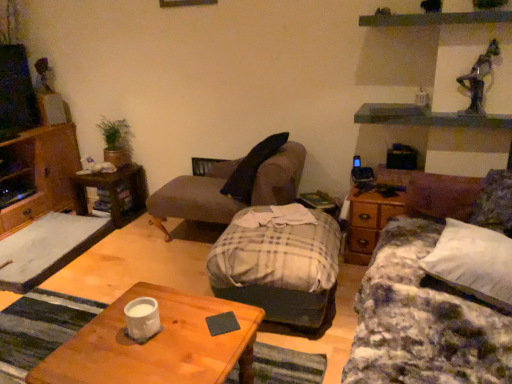
Where is `vacant space underneath green leafy plant at upper left (from a real-world perspective)`? The image size is (512, 384). vacant space underneath green leafy plant at upper left (from a real-world perspective) is located at coordinates (121, 166).